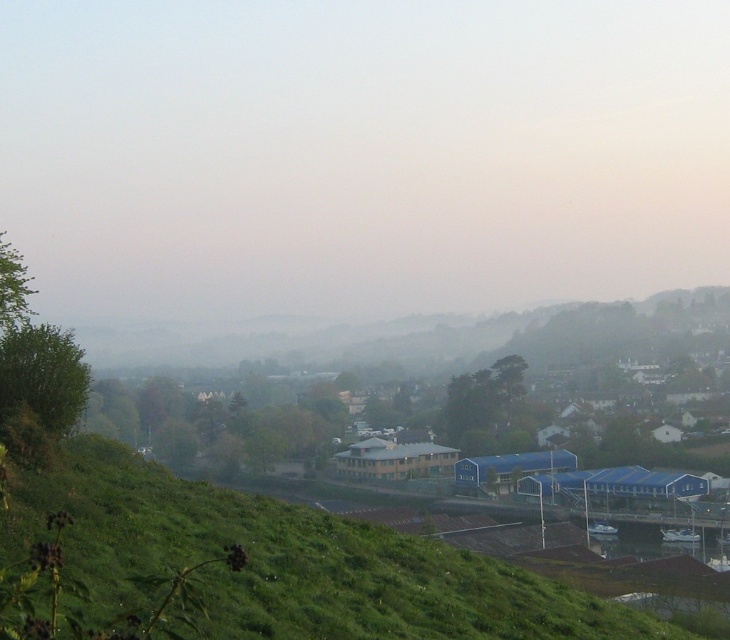
Question: Is foggy haze at center closer to the viewer compared to green grassy hillside at lower center?

Choices:
 (A) yes
 (B) no

Answer: (B)

Question: Is foggy haze at center smaller than green grassy hillside at lower center?

Choices:
 (A) no
 (B) yes

Answer: (A)

Question: Does foggy haze at center have a smaller size compared to green grassy hillside at lower center?

Choices:
 (A) yes
 (B) no

Answer: (B)